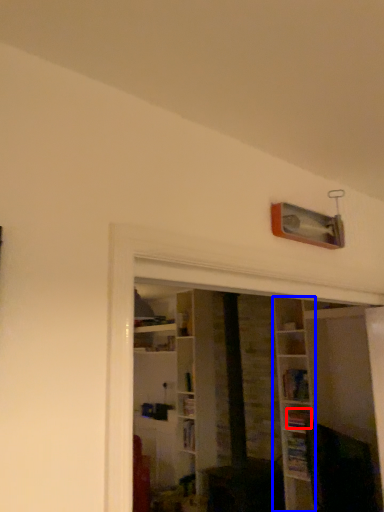
Question: Which object appears farthest to the camera in this image, book (highlighted by a red box) or shelf (highlighted by a blue box)?

Choices:
 (A) book
 (B) shelf

Answer: (A)